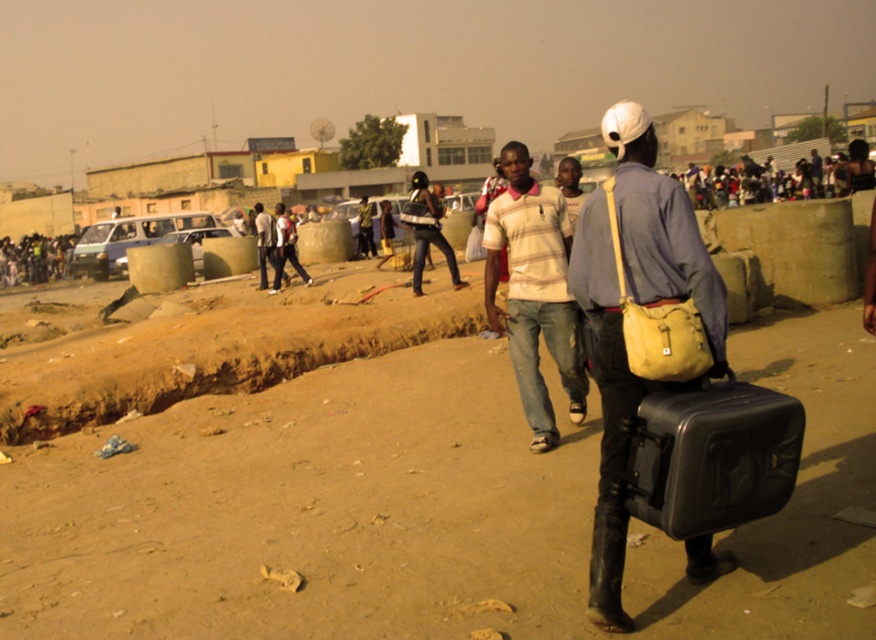
Question: Which of these objects is positioned closest to the black hard case at lower right?

Choices:
 (A) brown sandy dirt at center
 (B) striped cotton shirt at center
 (C) matte black suitcase at center
 (D) matte black helmet at center

Answer: (C)

Question: Can you confirm if black hard case at lower right is smaller than yellow fabric bag at center?

Choices:
 (A) yes
 (B) no

Answer: (A)

Question: Which point is closer to the camera?

Choices:
 (A) (704, 353)
 (B) (493, 234)
 (C) (758, 512)
 (D) (429, 236)

Answer: (A)

Question: Is matte black suitcase at center thinner than black hard case at lower right?

Choices:
 (A) yes
 (B) no

Answer: (A)

Question: Estimate the real-world distances between objects in this image. Which object is farther from the striped cotton shirt at center?

Choices:
 (A) brown sandy dirt at center
 (B) matte black helmet at center

Answer: (A)

Question: Is brown sandy dirt at center smaller than matte black suitcase at center?

Choices:
 (A) no
 (B) yes

Answer: (B)